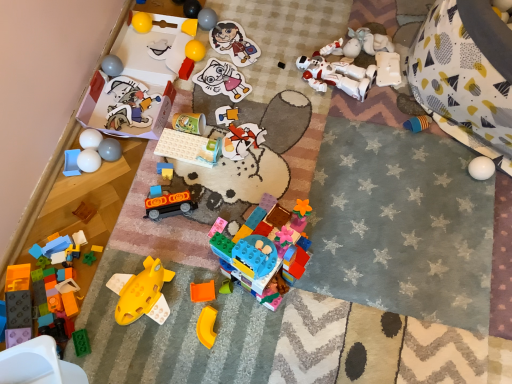
The height and width of the screenshot is (384, 512). I want to click on unoccupied area in front of matte plastic sticker at upper center, which is the 20th toy from left to right, so click(232, 90).